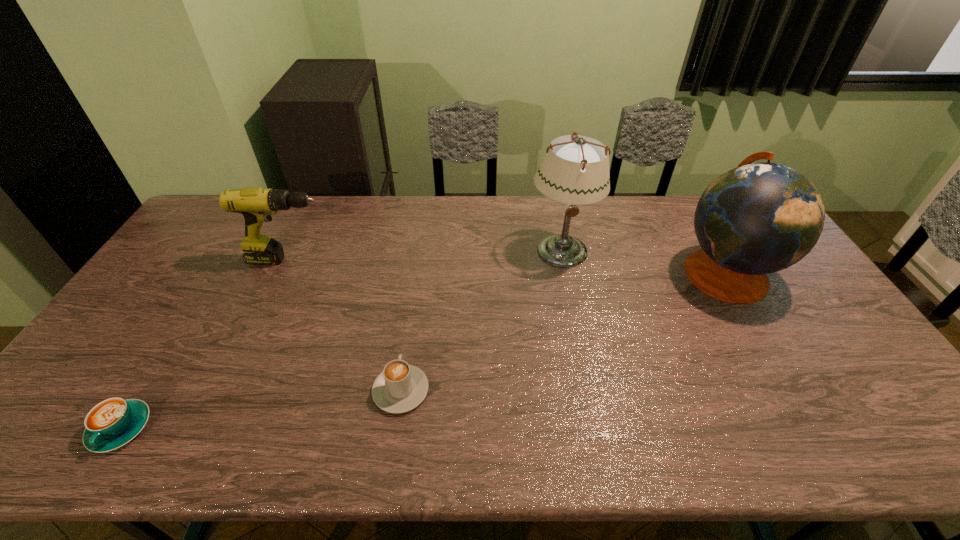
What are the coordinates of `free spot between the third tallest object and the rightmost object` in the screenshot? It's located at (507, 266).

Identify the location of free space that is in between the globe and the lampshade. tap(642, 261).

The width and height of the screenshot is (960, 540). In order to click on free space between the second object from right to left and the taller cappuccino in this screenshot , I will do `click(481, 321)`.

Where is `free spot between the second shortest object and the fourth object from left to right`? Image resolution: width=960 pixels, height=540 pixels. free spot between the second shortest object and the fourth object from left to right is located at coordinates (481, 321).

Where is `empty location between the leftmost object and the fourth object from left to right`? The width and height of the screenshot is (960, 540). empty location between the leftmost object and the fourth object from left to right is located at coordinates (341, 340).

What are the coordinates of `vacant space that is in between the globe and the fourth object from right to left` in the screenshot? It's located at (507, 266).

You are a GUI agent. You are given a task and a screenshot of the screen. Output one action in this format:
    pyautogui.click(x=<x>, y=<y>)
    Task: Click on the object that ranks as the fourth closest to the rightmost object
    
    Given the screenshot: What is the action you would take?
    pyautogui.click(x=112, y=423)

Locate which object is the fourth closest to the third object from left to right. Please provide its 2D coordinates. Your answer should be formatted as a tuple, i.e. [(x, y)], where the tuple contains the x and y coordinates of a point satisfying the conditions above.

[(756, 219)]

Locate an element on the screen. The height and width of the screenshot is (540, 960). free space that satisfies the following two spatial constraints: 1. on the lampshade of the second object from right to left; 2. on the handle side of the third shortest object is located at coordinates (563, 260).

Where is `free space that satisfies the following two spatial constraints: 1. to the right of the fourth tallest object; 2. on the handle side of the third shortest object`? This screenshot has width=960, height=540. free space that satisfies the following two spatial constraints: 1. to the right of the fourth tallest object; 2. on the handle side of the third shortest object is located at coordinates (420, 260).